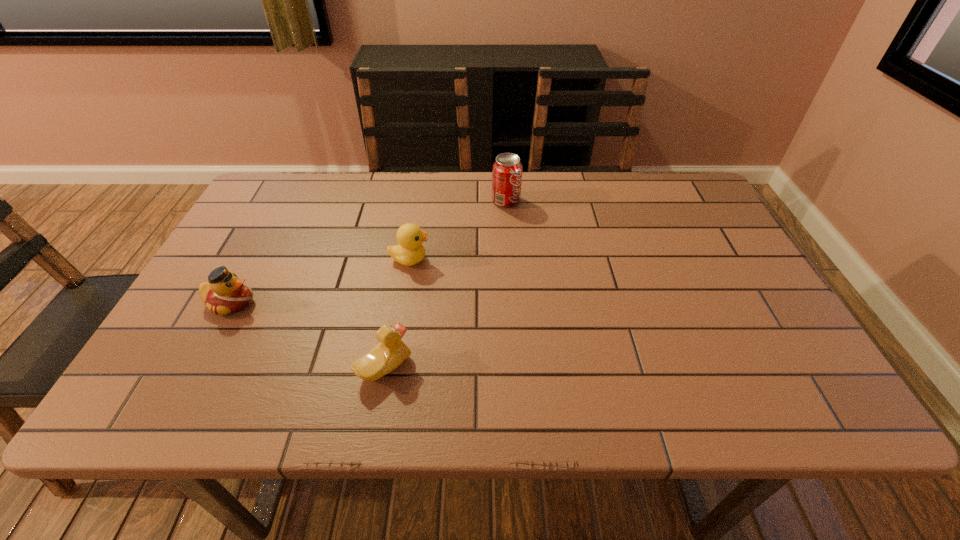
Locate an element on the screen. This screenshot has height=540, width=960. the tallest object is located at coordinates (507, 169).

Find the location of a particular element. The height and width of the screenshot is (540, 960). the farthest object is located at coordinates click(x=507, y=169).

What are the coordinates of `the farthest duck` in the screenshot? It's located at (410, 251).

You are a GUI agent. You are given a task and a screenshot of the screen. Output one action in this format:
    pyautogui.click(x=<x>, y=<y>)
    Task: Click on the second nearest object
    The image size is (960, 540).
    Given the screenshot: What is the action you would take?
    pyautogui.click(x=225, y=293)

The height and width of the screenshot is (540, 960). I want to click on the leftmost object, so click(225, 293).

You are a GUI agent. You are given a task and a screenshot of the screen. Output one action in this format:
    pyautogui.click(x=<x>, y=<y>)
    Task: Click on the nearest object
    The height and width of the screenshot is (540, 960).
    Given the screenshot: What is the action you would take?
    pyautogui.click(x=391, y=351)

At what (x,y) coordinates should I click in order to perform the action: click on free space located 0.160m on the left of the rightmost object. Please return your answer as a coordinate pair (x, y). Looking at the image, I should click on (437, 201).

Locate an element on the screen. Image resolution: width=960 pixels, height=540 pixels. free space located on the face of the second farthest object is located at coordinates (573, 259).

At what (x,y) coordinates should I click in order to perform the action: click on vacant position located on the face of the leftmost object. Please return your answer as a coordinate pair (x, y). Looking at the image, I should click on (395, 302).

Locate an element on the screen. free space located at the beak of the nearest object is located at coordinates (456, 367).